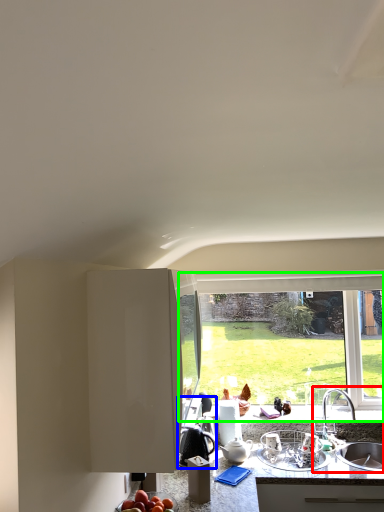
Question: Which object is the closest to the sink (highlighted by a red box)? Choose among these: appliance (highlighted by a blue box) or window (highlighted by a green box).

Choices:
 (A) appliance
 (B) window

Answer: (B)